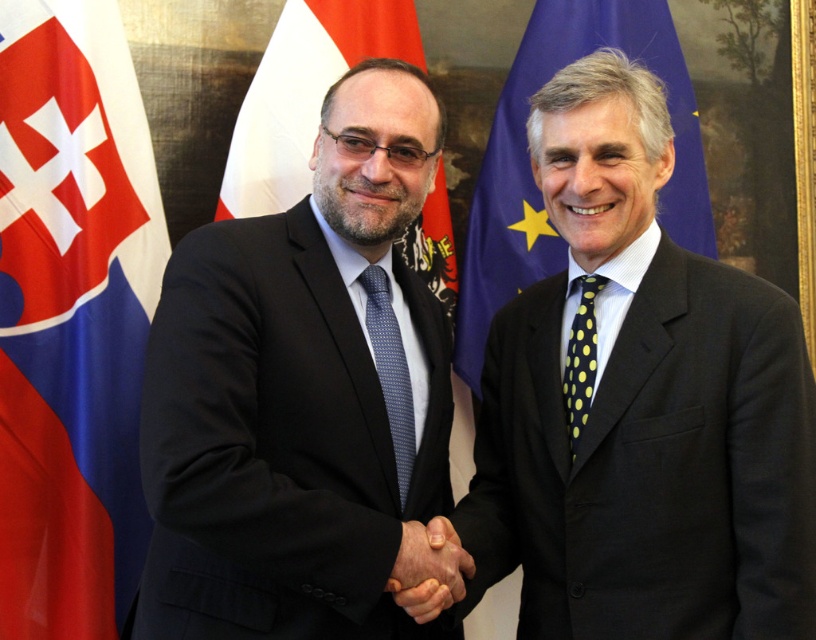
You are a photographer at the event and need to capture a clear photo of both the smooth skin handshake at center and the blue dotted tie at center. Given their positions, which one should you focus on first to ensure it appears in the foreground?

The blue dotted tie at center should be focused on first because it is taller than the smooth skin handshake at center, making it more prominent in the foreground.

You are a photographer at a diplomatic event. You need to capture a photo where the white fabric flag at upper center is clearly visible above the smooth skin handshake at center. Is the flag positioned in a way that allows this?

The white fabric flag at upper center is located above the smooth skin handshake at center, so yes, the flag is positioned in a way that allows it to be clearly visible above the handshake.